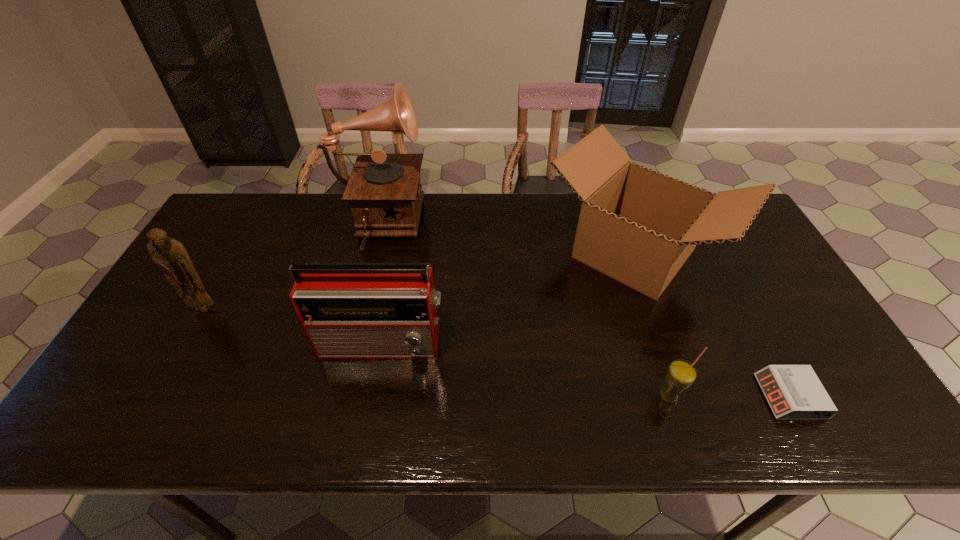
Identify the location of object present at the near right corner. This screenshot has height=540, width=960. (794, 392).

Find the location of a particular element. The height and width of the screenshot is (540, 960). free space at the far edge of the desktop is located at coordinates (305, 203).

In the image, there is a desktop. Where is `vacant space at the near edge`? The width and height of the screenshot is (960, 540). vacant space at the near edge is located at coordinates (241, 417).

In order to click on vacant space at the right edge of the desktop in this screenshot , I will do `click(825, 356)`.

The image size is (960, 540). In the image, there is a desktop. What are the coordinates of `free space at the far left corner` in the screenshot? It's located at (246, 213).

In order to click on free point between the alarm clock and the tallest object in this screenshot , I will do `click(584, 312)`.

At what (x,y) coordinates should I click in order to perform the action: click on free space between the box and the fourth farthest object. Please return your answer as a coordinate pair (x, y). The height and width of the screenshot is (540, 960). Looking at the image, I should click on (508, 298).

Locate an element on the screen. free space between the tallest object and the box is located at coordinates (506, 241).

I want to click on free space between the box and the record player, so [x=506, y=241].

Identify the location of unoccupied position between the figurine and the shortest object. The height and width of the screenshot is (540, 960). (497, 353).